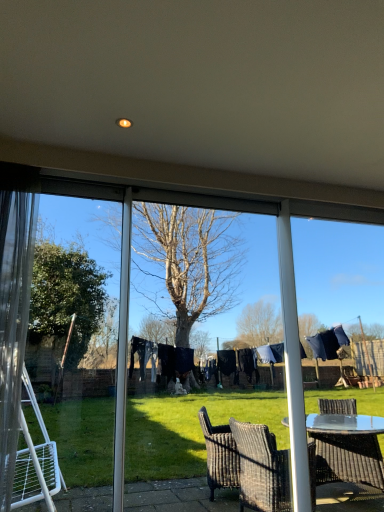
Question: Considering the positions of transparent glass screen door at left, which ranks as the first screen door in left-to-right order, and transparent plastic screen door at center, which ranks as the 1th screen door in right-to-left order, in the image, is transparent glass screen door at left, which ranks as the first screen door in left-to-right order, bigger or smaller than transparent plastic screen door at center, which ranks as the 1th screen door in right-to-left order,?

Choices:
 (A) small
 (B) big

Answer: (A)

Question: In terms of height, does transparent glass screen door at left, which ranks as the first screen door in left-to-right order, look taller or shorter compared to transparent plastic screen door at center, which ranks as the 1th screen door in right-to-left order?

Choices:
 (A) short
 (B) tall

Answer: (A)

Question: Which is nearer to the transparent glass screen door at left, which ranks as the first screen door in left-to-right order?

Choices:
 (A) transparent plastic screen door at center, which ranks as the 1th screen door in right-to-left order
 (B) clear glass window frame at right

Answer: (A)

Question: Which of these objects is positioned closest to the transparent plastic screen door at center, the second screen door viewed from the left?

Choices:
 (A) clear glass window frame at right
 (B) transparent glass screen door at left, the second screen door from the right

Answer: (B)